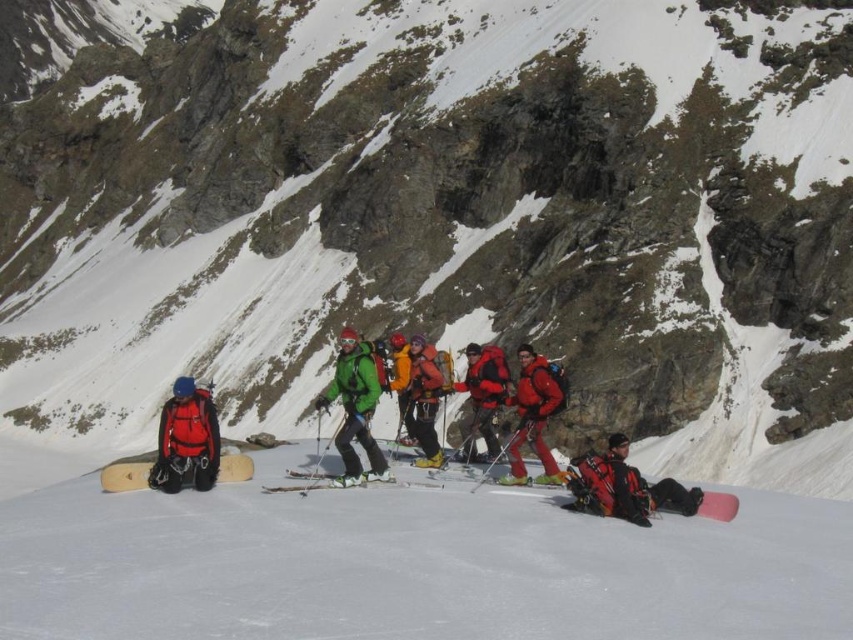
Based on the photo, who is taller, red matte backpack at left or yellow matte jacket at center?

With more height is yellow matte jacket at center.

Between red matte backpack at left and yellow matte jacket at center, which one appears on the left side from the viewer's perspective?

Positioned to the left is red matte backpack at left.

Which is behind, point (212, 461) or point (401, 337)?

The point (401, 337) is behind.

Identify the location of red matte backpack at left. This screenshot has height=640, width=853. (186, 438).

Which of these two, matte red jacket at center or matte orange jacket at center, stands shorter?

matte red jacket at center is shorter.

Does matte red jacket at center lie behind matte orange jacket at center?

No, it is not.

Is point (550, 456) in front of point (416, 392)?

That is True.

You are a GUI agent. You are given a task and a screenshot of the screen. Output one action in this format:
    pyautogui.click(x=<x>, y=<y>)
    Task: Click on the matte red jacket at center
    The width and height of the screenshot is (853, 640).
    Given the screenshot: What is the action you would take?
    pyautogui.click(x=534, y=413)

Is white snowboard at center to the right of matte orange jacket at center from the viewer's perspective?

In fact, white snowboard at center is to the left of matte orange jacket at center.

At what (x,y) coordinates should I click in order to perform the action: click on white snowboard at center. Please return your answer as a coordinate pair (x, y). The width and height of the screenshot is (853, 640). Looking at the image, I should click on (412, 564).